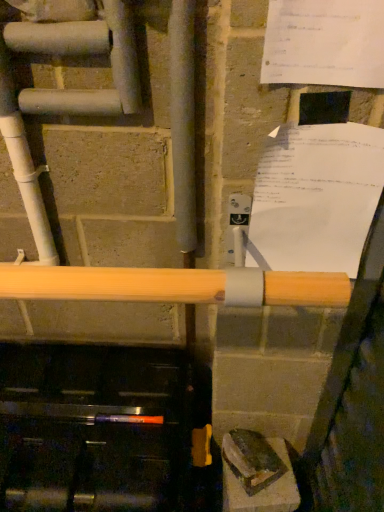
The width and height of the screenshot is (384, 512). What do you see at coordinates (315, 197) in the screenshot? I see `white paper at upper right, positioned as the second paper in front-to-back order` at bounding box center [315, 197].

In the scene shown: How much space does white paper at upper right, positioned as the second paper in front-to-back order, occupy horizontally?

It is 1.58 inches.

Where is `white paper at upper right, which is the 2th paper from top to bottom`? This screenshot has width=384, height=512. white paper at upper right, which is the 2th paper from top to bottom is located at coordinates (315, 197).

Locate an element on the screen. white paper at upper right, which ranks as the first paper in top-to-bottom order is located at coordinates (324, 42).

The height and width of the screenshot is (512, 384). Describe the element at coordinates (324, 42) in the screenshot. I see `white paper at upper right, the 2th paper when ordered from back to front` at that location.

Identify the location of white paper at upper right, marked as the 1th paper in a back-to-front arrangement. The image size is (384, 512). (315, 197).

Is white paper at upper right, arranged as the first paper when ordered from the bottom, at the left side of white paper at upper right, the 2th paper when ordered from back to front?

Incorrect, white paper at upper right, arranged as the first paper when ordered from the bottom, is not on the left side of white paper at upper right, the 2th paper when ordered from back to front.

Which is in front, white paper at upper right, marked as the 1th paper in a back-to-front arrangement, or white paper at upper right, marked as the 1th paper in a front-to-back arrangement?

white paper at upper right, marked as the 1th paper in a front-to-back arrangement, is more forward.

Does point (283, 135) come closer to viewer compared to point (277, 42)?

No, (283, 135) is behind (277, 42).

From the image's perspective, which object appears higher, white paper at upper right, marked as the 1th paper in a back-to-front arrangement, or white paper at upper right, marked as the second paper in a bottom-to-top arrangement?

white paper at upper right, marked as the second paper in a bottom-to-top arrangement.

From a real-world perspective, which is physically above, white paper at upper right, positioned as the second paper in front-to-back order, or white paper at upper right, which ranks as the first paper in top-to-bottom order?

white paper at upper right, which ranks as the first paper in top-to-bottom order, from a real-world perspective.

Which of these two, white paper at upper right, marked as the 1th paper in a back-to-front arrangement, or white paper at upper right, marked as the 1th paper in a front-to-back arrangement, is wider?

white paper at upper right, marked as the 1th paper in a back-to-front arrangement, is wider.

Is white paper at upper right, positioned as the second paper in front-to-back order, taller or shorter than white paper at upper right, which ranks as the first paper in top-to-bottom order?

Clearly, white paper at upper right, positioned as the second paper in front-to-back order, is shorter compared to white paper at upper right, which ranks as the first paper in top-to-bottom order.

Considering the sizes of objects white paper at upper right, marked as the 1th paper in a back-to-front arrangement, and white paper at upper right, marked as the second paper in a bottom-to-top arrangement, in the image provided, who is smaller, white paper at upper right, marked as the 1th paper in a back-to-front arrangement, or white paper at upper right, marked as the second paper in a bottom-to-top arrangement,?

With smaller size is white paper at upper right, marked as the second paper in a bottom-to-top arrangement.

Is white paper at upper right, positioned as the second paper in front-to-back order, inside or outside of white paper at upper right, marked as the 1th paper in a front-to-back arrangement?

white paper at upper right, positioned as the second paper in front-to-back order, is outside white paper at upper right, marked as the 1th paper in a front-to-back arrangement.

Are white paper at upper right, which is the 2th paper from top to bottom, and white paper at upper right, marked as the 1th paper in a front-to-back arrangement, making contact?

There is a gap between white paper at upper right, which is the 2th paper from top to bottom, and white paper at upper right, marked as the 1th paper in a front-to-back arrangement.

Is white paper at upper right, marked as the 1th paper in a back-to-front arrangement, oriented towards white paper at upper right, marked as the 1th paper in a front-to-back arrangement?

No, white paper at upper right, marked as the 1th paper in a back-to-front arrangement, is not turned towards white paper at upper right, marked as the 1th paper in a front-to-back arrangement.

How many degrees apart are the facing directions of white paper at upper right, positioned as the second paper in front-to-back order, and white paper at upper right, the 2th paper when ordered from back to front?

The facing directions of white paper at upper right, positioned as the second paper in front-to-back order, and white paper at upper right, the 2th paper when ordered from back to front, are 0.00665 degrees apart.

Locate an element on the screen. Image resolution: width=384 pixels, height=512 pixels. paper on the left side of white paper at upper right, arranged as the first paper when ordered from the bottom is located at coordinates (324, 42).

Does white paper at upper right, marked as the 1th paper in a front-to-back arrangement, appear on the right side of white paper at upper right, which is the 2th paper from top to bottom?

No.

Is white paper at upper right, marked as the second paper in a bottom-to-top arrangement, further to the viewer compared to white paper at upper right, marked as the 1th paper in a back-to-front arrangement?

No, white paper at upper right, marked as the second paper in a bottom-to-top arrangement, is closer to the viewer.

Does point (376, 13) lie in front of point (381, 169)?

Yes, it is in front of point (381, 169).

From the image's perspective, is white paper at upper right, the 2th paper when ordered from back to front, over white paper at upper right, positioned as the second paper in front-to-back order?

Correct, white paper at upper right, the 2th paper when ordered from back to front, appears higher than white paper at upper right, positioned as the second paper in front-to-back order, in the image.

From a real-world perspective, which is physically above, white paper at upper right, which ranks as the first paper in top-to-bottom order, or white paper at upper right, positioned as the second paper in front-to-back order?

white paper at upper right, which ranks as the first paper in top-to-bottom order, is physically above.

Which of these two, white paper at upper right, marked as the second paper in a bottom-to-top arrangement, or white paper at upper right, which is the 2th paper from top to bottom, is thinner?

Thinner between the two is white paper at upper right, marked as the second paper in a bottom-to-top arrangement.

Which of these two, white paper at upper right, marked as the second paper in a bottom-to-top arrangement, or white paper at upper right, arranged as the first paper when ordered from the bottom, stands shorter?

white paper at upper right, arranged as the first paper when ordered from the bottom.

Does white paper at upper right, marked as the second paper in a bottom-to-top arrangement, have a smaller size compared to white paper at upper right, positioned as the second paper in front-to-back order?

Yes.

Which is correct: white paper at upper right, the 2th paper when ordered from back to front, is inside white paper at upper right, marked as the 1th paper in a back-to-front arrangement, or outside of it?

white paper at upper right, the 2th paper when ordered from back to front, cannot be found inside white paper at upper right, marked as the 1th paper in a back-to-front arrangement.

In the scene shown: Would you consider white paper at upper right, the 2th paper when ordered from back to front, to be distant from white paper at upper right, arranged as the first paper when ordered from the bottom?

No, there isn't a large distance between white paper at upper right, the 2th paper when ordered from back to front, and white paper at upper right, arranged as the first paper when ordered from the bottom.

Does white paper at upper right, which ranks as the first paper in top-to-bottom order, turn towards white paper at upper right, arranged as the first paper when ordered from the bottom?

No, white paper at upper right, which ranks as the first paper in top-to-bottom order, is not oriented towards white paper at upper right, arranged as the first paper when ordered from the bottom.

How much distance is there between white paper at upper right, marked as the 1th paper in a front-to-back arrangement, and white paper at upper right, positioned as the second paper in front-to-back order?

A distance of 7.09 inches exists between white paper at upper right, marked as the 1th paper in a front-to-back arrangement, and white paper at upper right, positioned as the second paper in front-to-back order.

This screenshot has height=512, width=384. I want to click on paper in front of the white paper at upper right, arranged as the first paper when ordered from the bottom, so coord(324,42).

This screenshot has height=512, width=384. Find the location of `paper behind the white paper at upper right, the 2th paper when ordered from back to front`. paper behind the white paper at upper right, the 2th paper when ordered from back to front is located at coordinates (315, 197).

This screenshot has width=384, height=512. I want to click on paper lying below the white paper at upper right, the 2th paper when ordered from back to front (from the image's perspective), so click(315, 197).